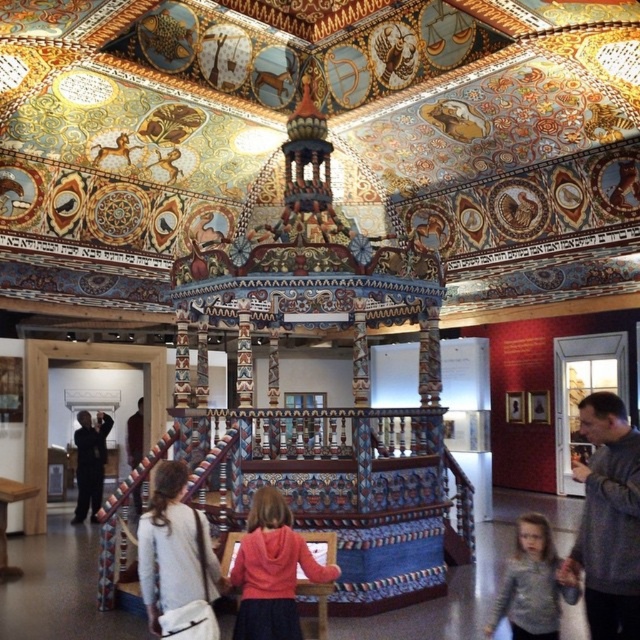
You are an interior designer planning to place a small decorative item on the floor between the gray sweater at center and the white fabric bag at lower left. Which object should you place it closer to if you want it to be near the larger item?

You should place the decorative item closer to the gray sweater at center since it is larger in size than the white fabric bag at lower left.

You are a visitor in the museum and you see the matte pink hoodie at center and the black matte suit at left. Which clothing item is covering the other one?

The matte pink hoodie at center is positioned over the black matte suit at left, so it is covering the other one.

You are standing in the museum exhibit and want to take a photo of the point at coordinates (612, 412). The camera you have can focus clearly up to 100 feet. Will the point be in focus?

The point at coordinates (612, 412) is 84.24 feet away from the viewer, which is within the camera focus range of up to 100 feet. Therefore, the point will be in focus.